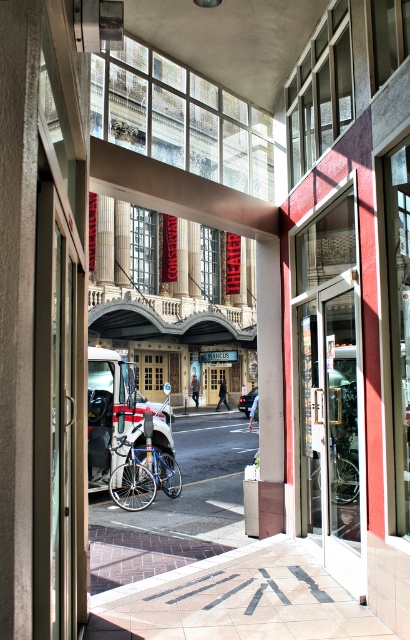
You are a delivery person who needs to load a package onto a bicycle. You see a blue metallic bicycle at center and a silver metallic bicycle at center. Which bicycle is closer to the left side of the street?

The blue metallic bicycle at center is positioned on the left side of silver metallic bicycle at center, so it is closer to the left side of the street.

You are standing at the doorway and want to walk to the silver metallic bicycle at center. Which direction should you move relative to the metallic pavement at center?

To reach the silver metallic bicycle at center, you should move to the right of the metallic pavement at center since it is located to the left of the bicycle.

You are a delivery person standing at the doorway and need to place a box on the metallic pavement at center. However, there is a white matte car at center in the way. Can you place the box on the pavement without moving the car?

The metallic pavement at center is not as tall as the white matte car at center, so the car is taller than the pavement. Since the car is blocking the path, you cannot place the box on the pavement without moving the car.